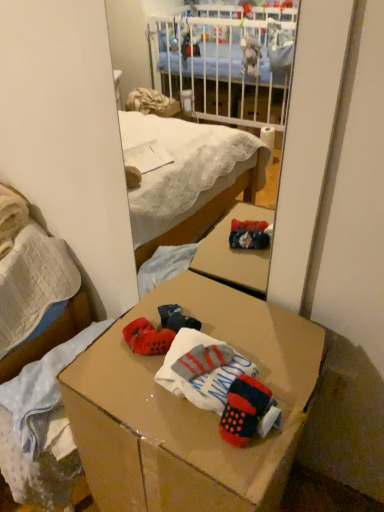
Locate an element on the screen. matte cardboard box at lower center is located at coordinates (38, 362).

Describe the element at coordinates (247, 411) in the screenshot. This screenshot has width=384, height=512. I see `knitted wool socks at center` at that location.

The height and width of the screenshot is (512, 384). I want to click on matte cardboard box at lower center, so click(38, 362).

Considering the sizes of objects knitted wool socks at center and cardboard box at center in the image provided, who is wider, knitted wool socks at center or cardboard box at center?

With larger width is cardboard box at center.

Is point (227, 440) closer or farther from the camera than point (77, 417)?

Point (227, 440) appears to be closer to the viewer than point (77, 417).

From the picture: Considering the relative positions of knitted wool socks at center and cardboard box at center in the image provided, is knitted wool socks at center behind cardboard box at center?

Yes, knitted wool socks at center is further from the viewer.

Who is shorter, knitted wool socks at center or cardboard box at center?

knitted wool socks at center is shorter.

Are knitted wool socks at center and matte cardboard box at lower center far apart?

That's not correct — knitted wool socks at center is a little close to matte cardboard box at lower center.

Find the location of a particular element. The width and height of the screenshot is (384, 512). toy located in front of the matte cardboard box at lower center is located at coordinates (247, 411).

Considering the positions of points (263, 395) and (4, 291), is point (263, 395) closer to camera compared to point (4, 291)?

That is True.

Is knitted wool socks at center behind matte cardboard box at lower center?

No, it is in front of matte cardboard box at lower center.

Consider the image. Does cardboard box at center have a lesser height compared to matte cardboard box at lower center?

In fact, cardboard box at center may be taller than matte cardboard box at lower center.

Which of these two, cardboard box at center or matte cardboard box at lower center, is smaller?

matte cardboard box at lower center.

From the picture: From a real-world perspective, does cardboard box at center stand above matte cardboard box at lower center?

Yes, from a real-world perspective, cardboard box at center is above matte cardboard box at lower center.

Can you tell me how much cardboard box at center and knitted wool socks at center differ in facing direction?

1.43 degrees separate the facing orientations of cardboard box at center and knitted wool socks at center.

Who is bigger, cardboard box at center or knitted wool socks at center?

cardboard box at center is bigger.

Is cardboard box at center not close to knitted wool socks at center?

No, cardboard box at center is in close proximity to knitted wool socks at center.

Which is more distant, (147, 450) or (259, 394)?

The point (147, 450) is farther.

Can you confirm if matte cardboard box at lower center is shorter than cardboard box at center?

Indeed, matte cardboard box at lower center has a lesser height compared to cardboard box at center.

How many degrees apart are the facing directions of matte cardboard box at lower center and cardboard box at center?

The angular difference between matte cardboard box at lower center and cardboard box at center is 6.19 degrees.

From a real-world perspective, is matte cardboard box at lower center under cardboard box at center?

Correct, in the physical world, matte cardboard box at lower center is lower than cardboard box at center.

Is matte cardboard box at lower center positioned with its back to cardboard box at center?

No, matte cardboard box at lower center is not facing away from cardboard box at center.

Could you tell me if matte cardboard box at lower center is turned towards knitted wool socks at center?

No, matte cardboard box at lower center does not turn towards knitted wool socks at center.

Considering the points (6, 391) and (253, 407), which point is behind, point (6, 391) or point (253, 407)?

Point (6, 391)

Which of these two, matte cardboard box at lower center or knitted wool socks at center, stands taller?

matte cardboard box at lower center.

Is matte cardboard box at lower center positioned far away from knitted wool socks at center?

No, there isn't a large distance between matte cardboard box at lower center and knitted wool socks at center.

You are a GUI agent. You are given a task and a screenshot of the screen. Output one action in this format:
    pyautogui.click(x=<x>, y=<y>)
    Task: Click on the desk that is under the knitted wool socks at center (from a real-world perspective)
    This screenshot has height=512, width=384.
    Given the screenshot: What is the action you would take?
    pyautogui.click(x=189, y=409)

I want to click on toy in front of the matte cardboard box at lower center, so click(247, 411).

Considering their positions, is cardboard box at center positioned closer to matte cardboard box at lower center than knitted wool socks at center?

Based on the image, cardboard box at center appears to be nearer to matte cardboard box at lower center.

Which object lies nearer to the anchor point matte cardboard box at lower center, knitted wool socks at center or cardboard box at center?

Based on the image, cardboard box at center appears to be nearer to matte cardboard box at lower center.

From the image, which object appears to be farther from knitted wool socks at center, matte cardboard box at lower center or cardboard box at center?

matte cardboard box at lower center is positioned further to the anchor knitted wool socks at center.

Which object lies nearer to the anchor point knitted wool socks at center, cardboard box at center or matte cardboard box at lower center?

Based on the image, cardboard box at center appears to be nearer to knitted wool socks at center.

Looking at the image, which one is located closer to cardboard box at center, matte cardboard box at lower center or knitted wool socks at center?

Based on the image, knitted wool socks at center appears to be nearer to cardboard box at center.

From the image, which object appears to be farther from cardboard box at center, knitted wool socks at center or matte cardboard box at lower center?

matte cardboard box at lower center.

This screenshot has width=384, height=512. Find the location of `desk situated between matte cardboard box at lower center and knitted wool socks at center from left to right`. desk situated between matte cardboard box at lower center and knitted wool socks at center from left to right is located at coordinates (189, 409).